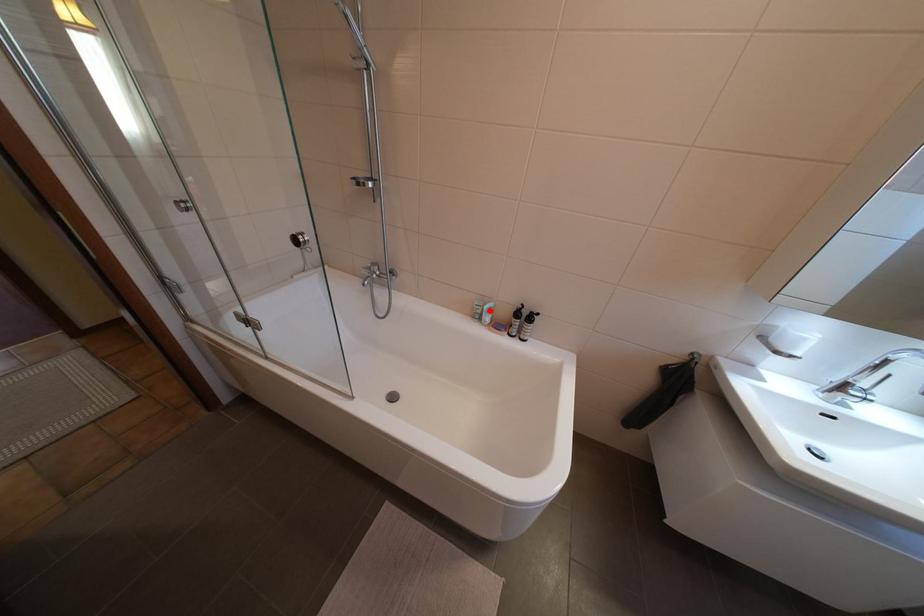
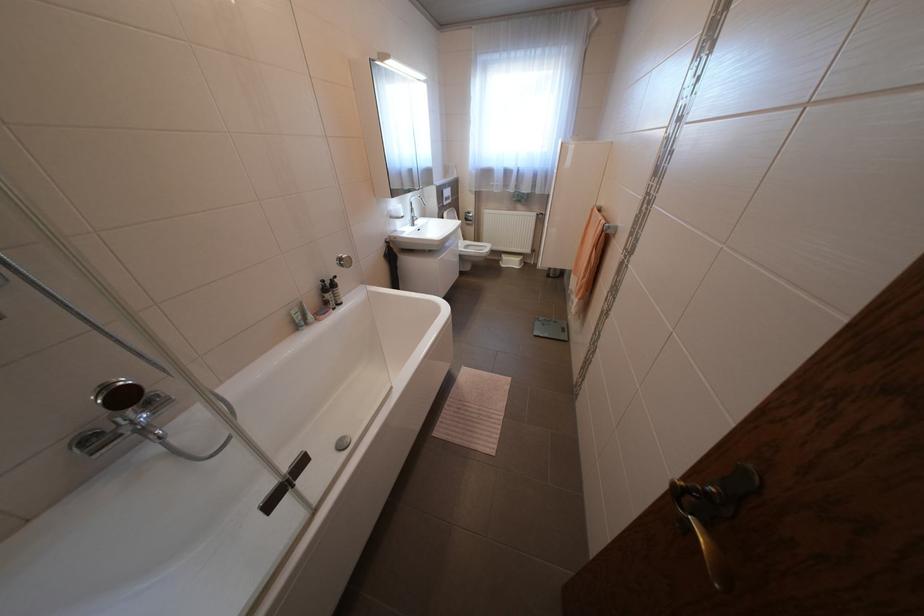
Find the pixel in the second image that matches the highlighted location in the first image.

(310, 315)